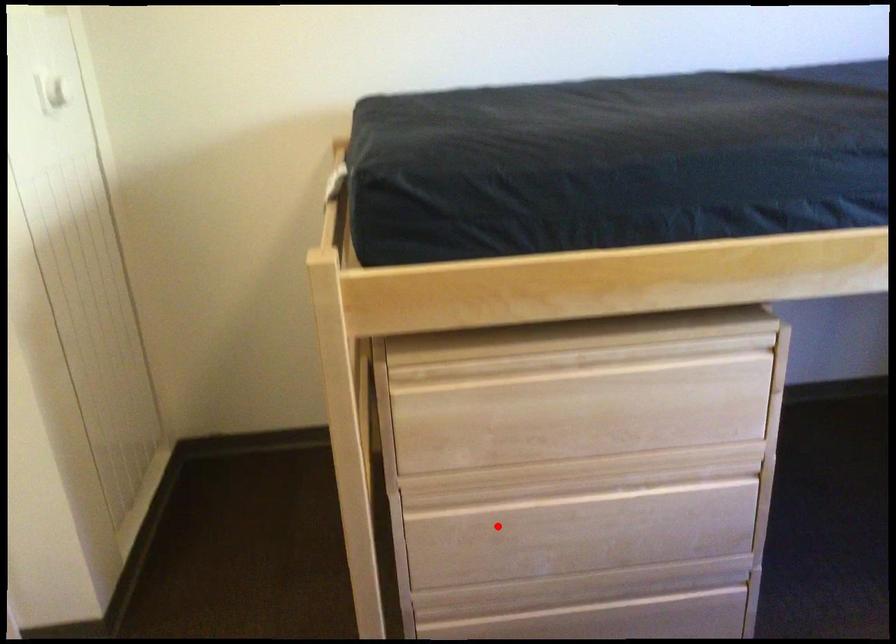
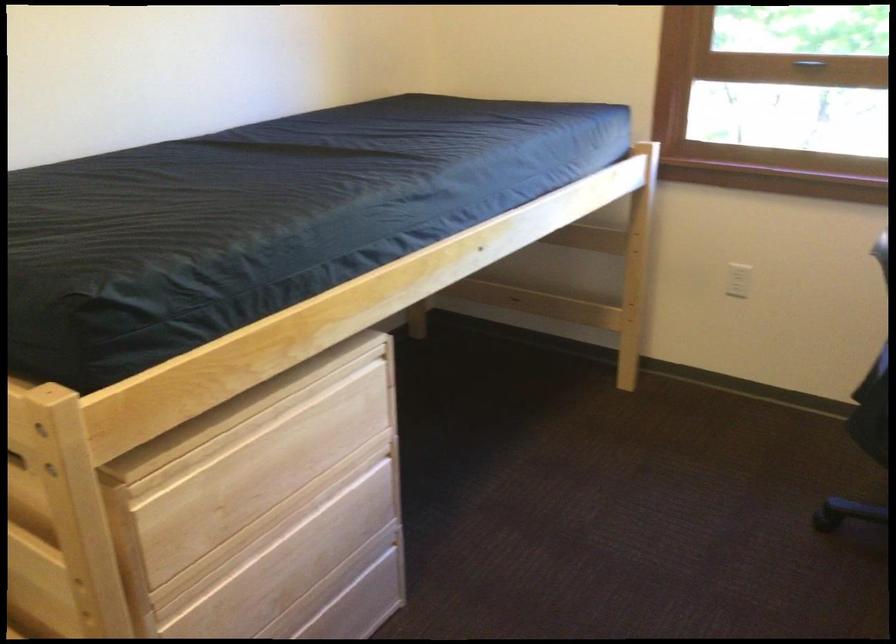
The point at the highlighted location is marked in the first image. Where is the corresponding point in the second image?

(230, 601)